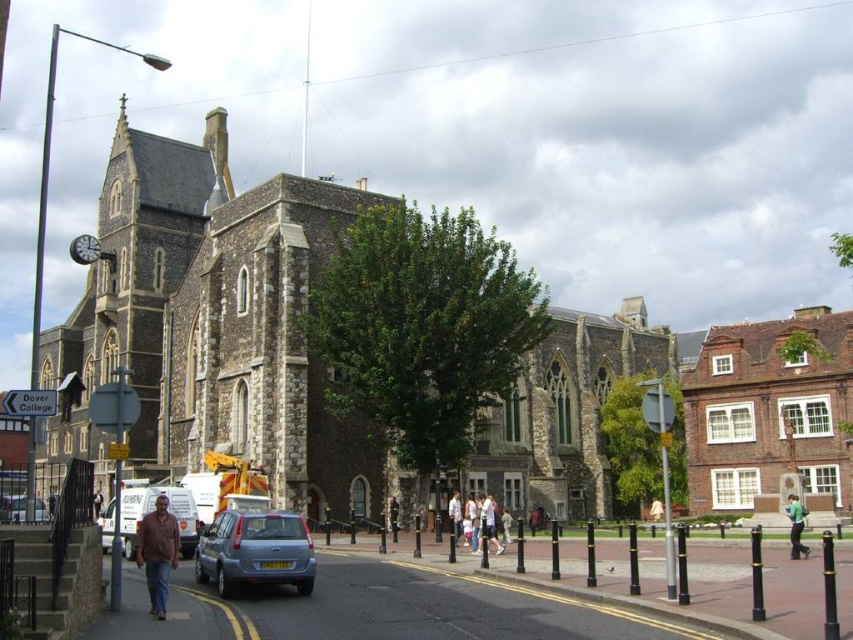
You are a delivery driver who needs to park your metallic silver car at lower left closer to the stone church at center. Based on the scene, can you move the car forward to get closer to the building?

The stone church at center is located above the metallic silver car at lower left, meaning the car is already positioned in front of the building. Moving it forward might not be possible due to the presence of bollards and pedestrians on the sidewalk, so it cannot get closer.

You are standing at the center of the street facing the Dover College building. You want to take a photo of the building without any obstructions. Is there a metallic silver car at lower left blocking your view?

The metallic silver car at lower left is located at point (12, 508), which is at the lower left corner of the image. Since you are standing at the center facing the building, the car is likely not blocking your view of the building as it is positioned to the side and lower part of the scene.

You are standing on the sidewalk in front of Dover College and want to take a photo of the building. There are two points marked on the ground at coordinates point (582, 346) and point (3, 518). Which point should you stand at to ensure the entire building is visible without the tree blocking it?

You should stand at point (3, 518) because point (582, 346) is behind it, meaning the tree might block the view from the latter point.